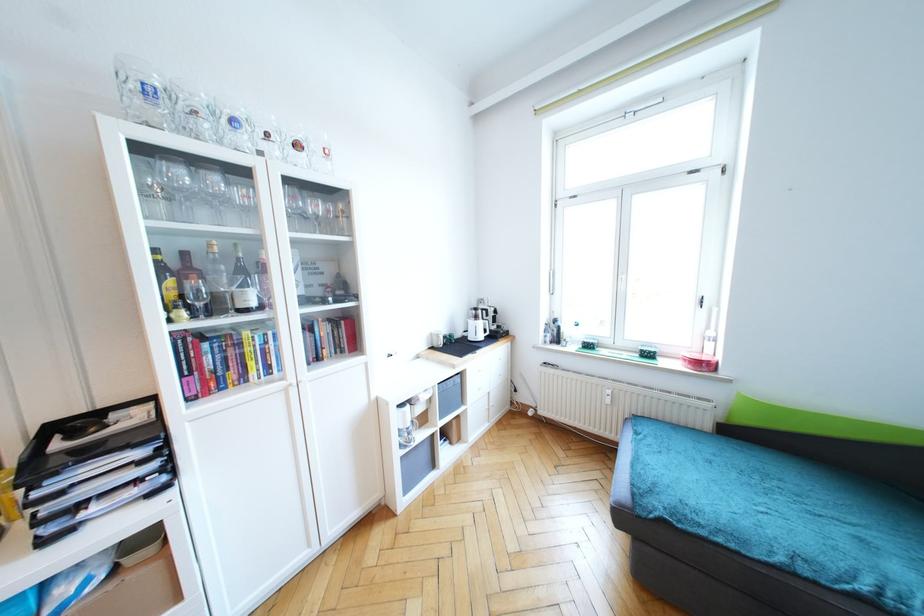
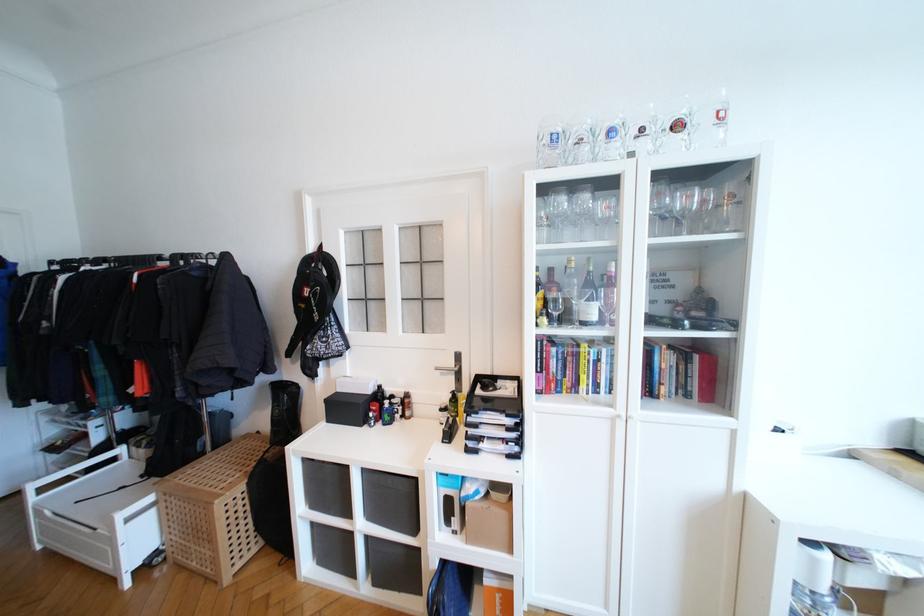
Locate, in the second image, the point that corresponds to the point at 239,126 in the first image.

(616, 136)